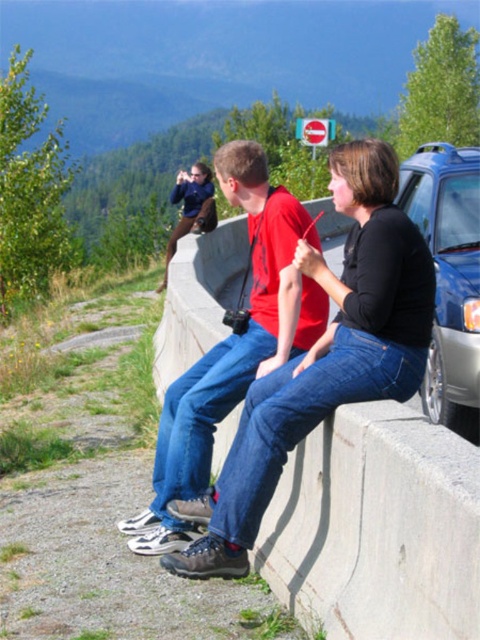
You are a delivery person carrying a box that requires a 4 meter clearance to avoid hitting obstacles. You need to pass between the red cotton shirt at center and the satin blue car at right. Is there enough space between them for your delivery route?

The distance between the red cotton shirt at center and the satin blue car at right is 3.80 meters. Since the required clearance is 4 meters, the space is insufficient. You should choose a different path to avoid collision.

You are a photographer trying to capture a photo of the red cotton shirt at center and the satin blue car at right. Based on their positions, which object should you focus on first if you want to include both in your frame?

The red cotton shirt at center is below the satin blue car at right, so you should focus on the red cotton shirt at center first to ensure both are in frame.

You are a pedestrian standing at the center of the road. You see the satin blue car at right and the matte black jacket at upper center. Which object is closer to the ground?

The satin blue car at right is below matte black jacket at upper center, so the satin blue car at right is closer to the ground.